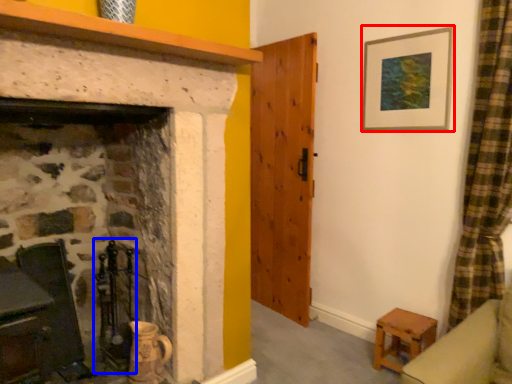
Question: Among these objects, which one is farthest to the camera, picture frame (highlighted by a red box) or chair (highlighted by a blue box)?

Choices:
 (A) picture frame
 (B) chair

Answer: (A)